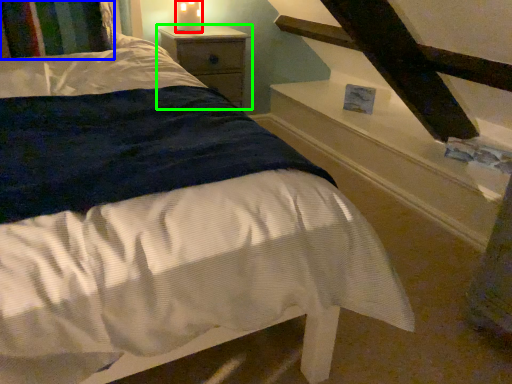
Question: Considering the real-world distances, which object is closest to candle holder (highlighted by a red box)? pillow (highlighted by a blue box) or nightstand (highlighted by a green box).

Choices:
 (A) pillow
 (B) nightstand

Answer: (B)